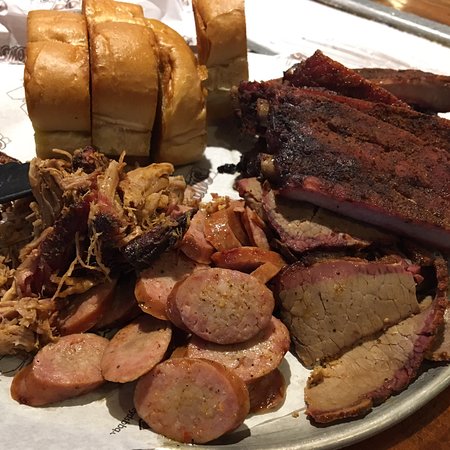
Identify the location of wooden table underneath the platter. (425, 438), (436, 10).